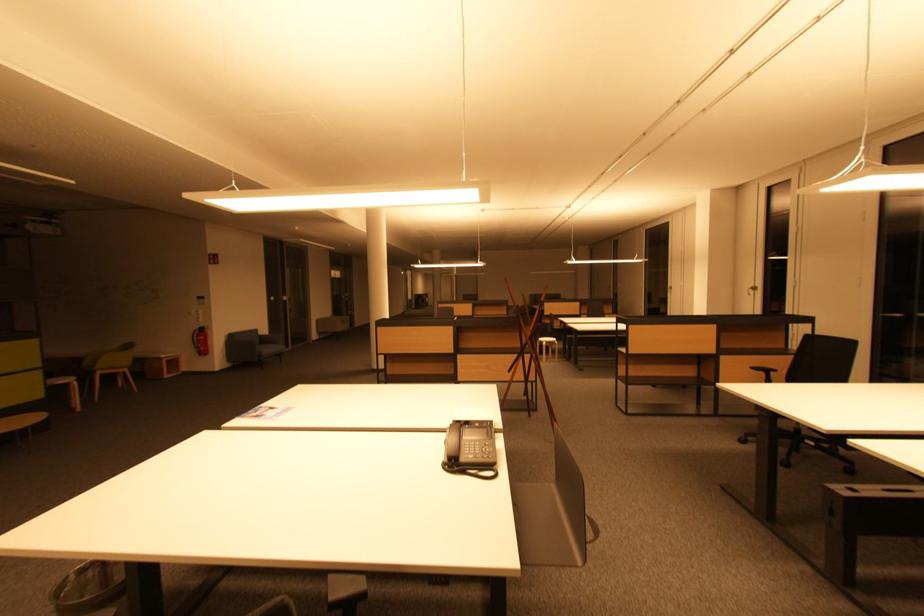
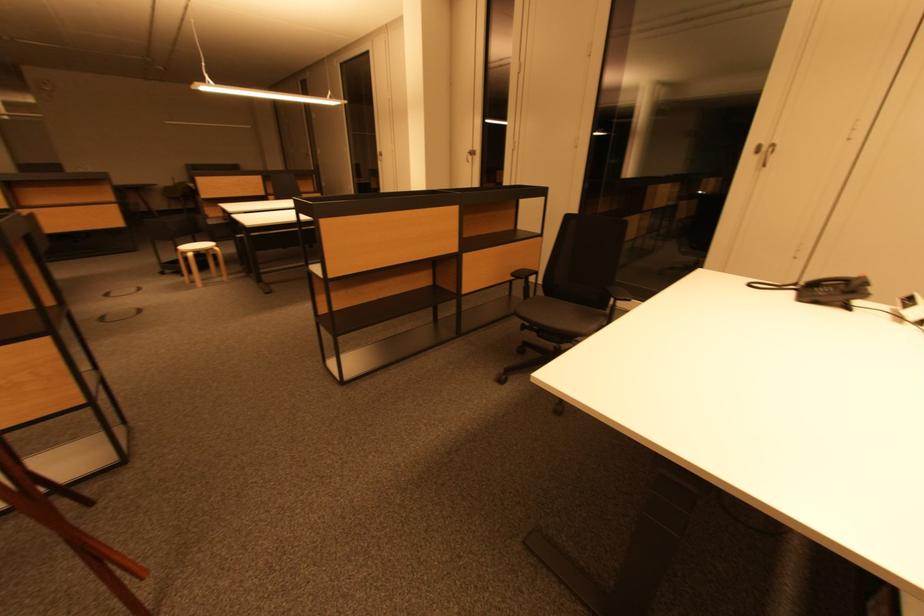
The point at (728, 360) is marked in the first image. Where is the corresponding point in the second image?

(470, 259)